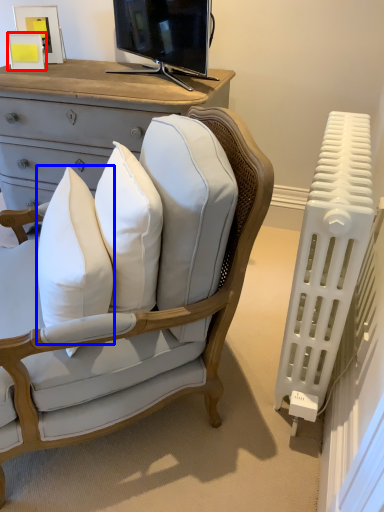
Question: Which object is closer to the camera taking this photo, picture frame (highlighted by a red box) or pillow (highlighted by a blue box)?

Choices:
 (A) picture frame
 (B) pillow

Answer: (B)